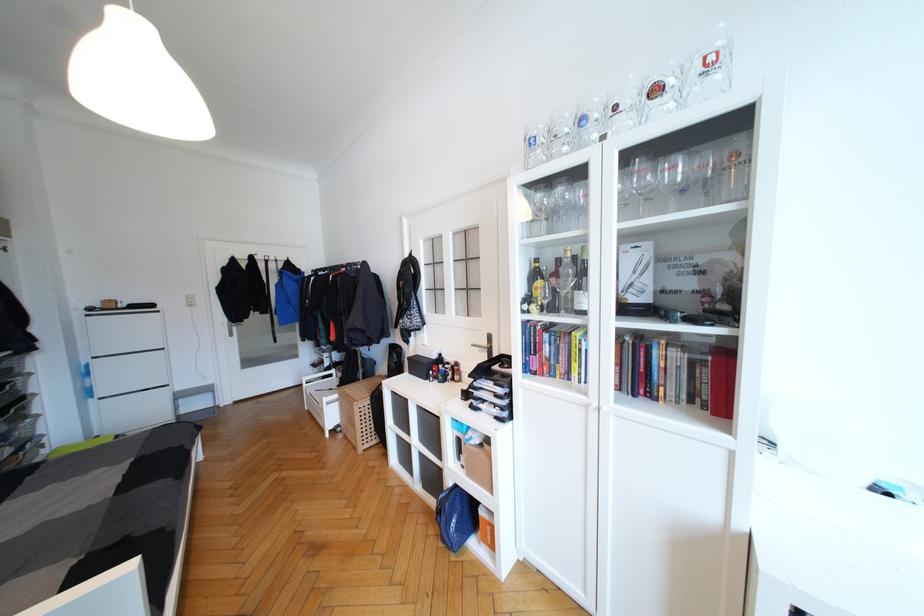
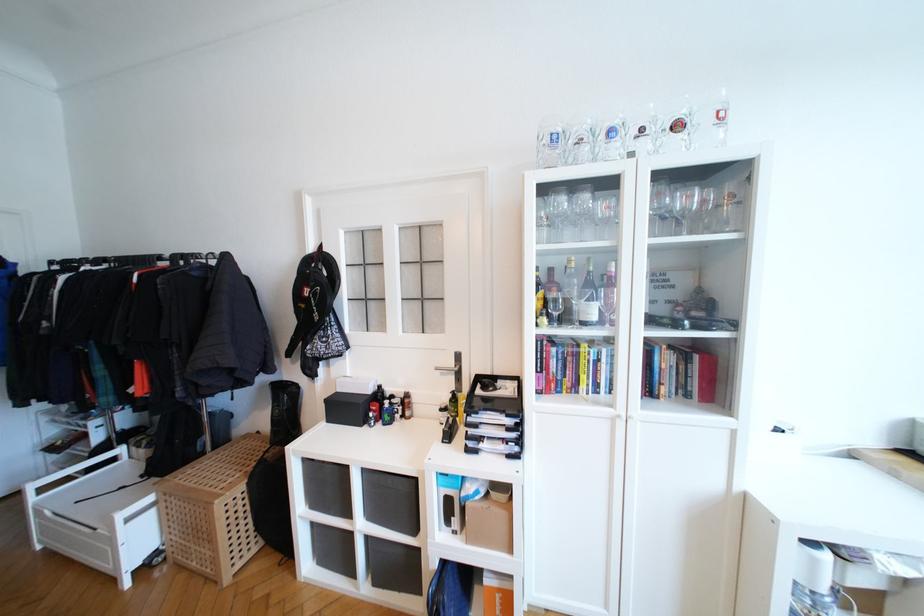
The point at (438, 358) is marked in the first image. Where is the corresponding point in the second image?

(372, 392)